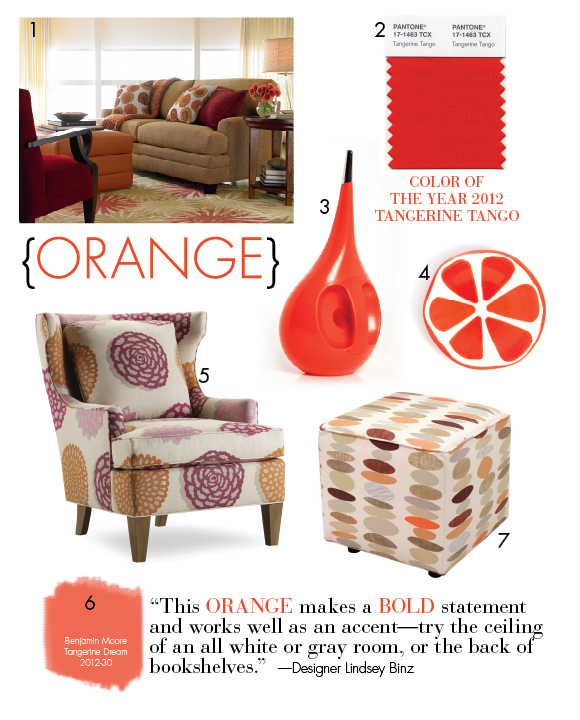
Image resolution: width=580 pixels, height=720 pixels. Find the location of `cushions`. cushions is located at coordinates (186, 425), (181, 132), (133, 121), (58, 163).